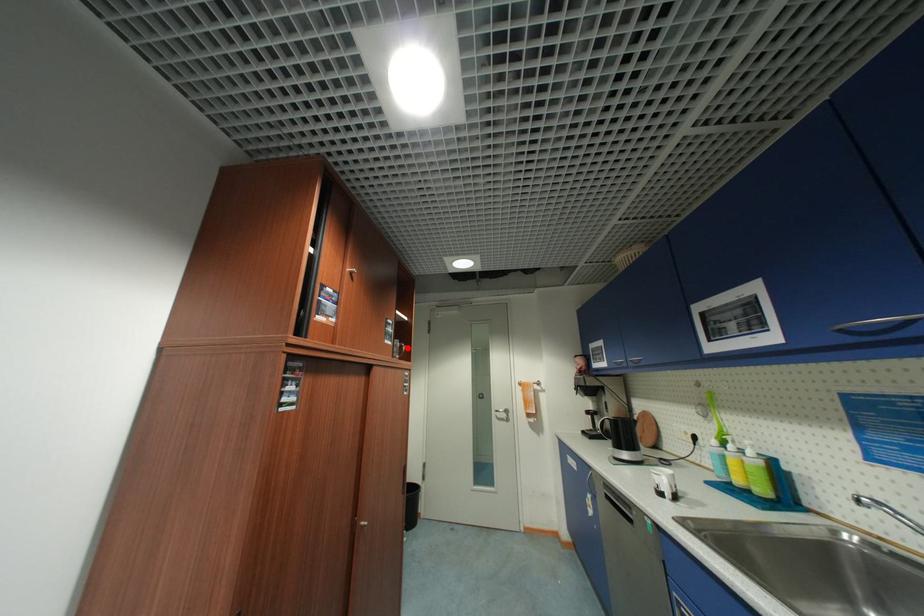
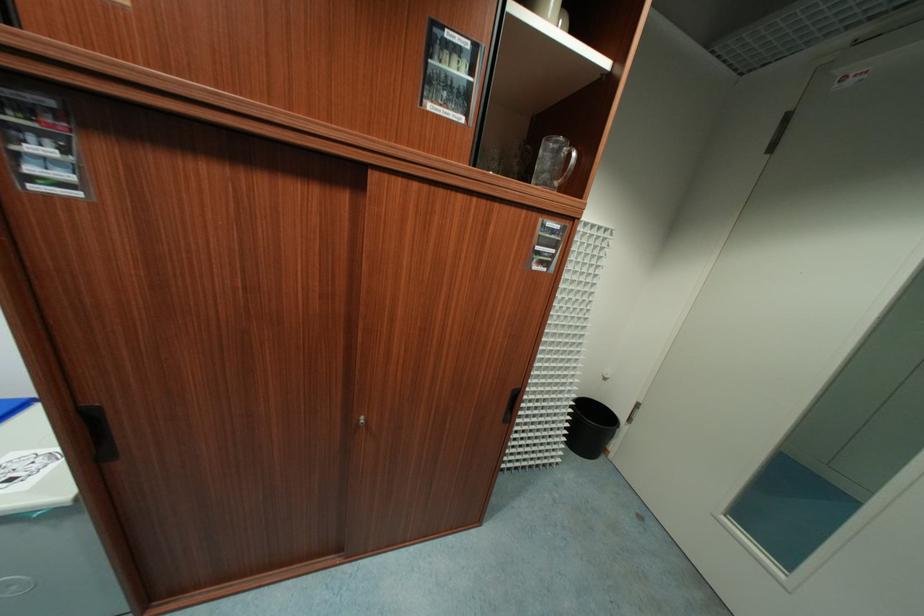
In the second image, find the point that corresponds to the highlighted location in the first image.

(574, 158)